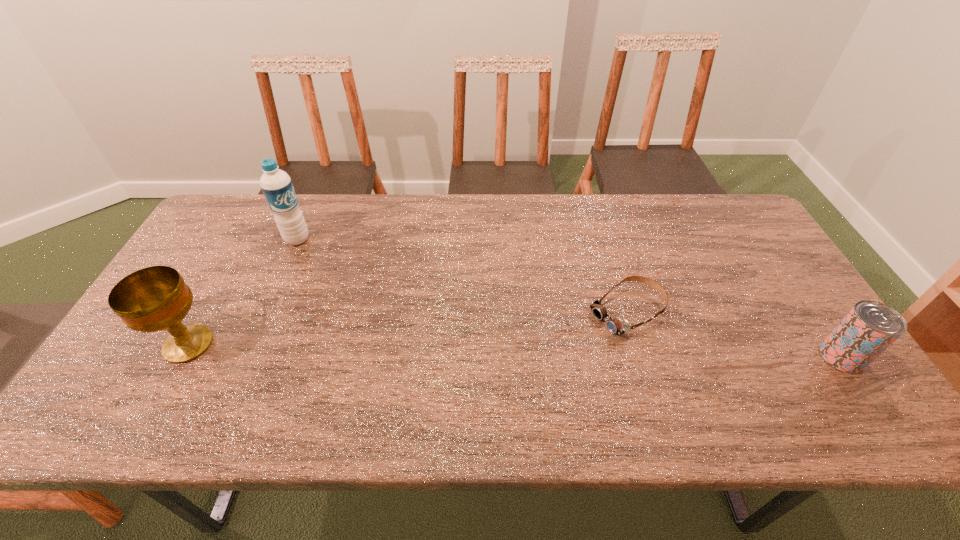
You are a GUI agent. You are given a task and a screenshot of the screen. Output one action in this format:
    pyautogui.click(x=<x>, y=<y>)
    Task: Click on the object that stands as the third closest to the second object from right to left
    The image size is (960, 540).
    Given the screenshot: What is the action you would take?
    pyautogui.click(x=156, y=298)

At what (x,y) coordinates should I click in order to perform the action: click on free space that satisfies the following two spatial constraints: 1. on the back side of the third shortest object; 2. on the left side of the water bottle. Please return your answer as a coordinate pair (x, y). Looking at the image, I should click on (247, 239).